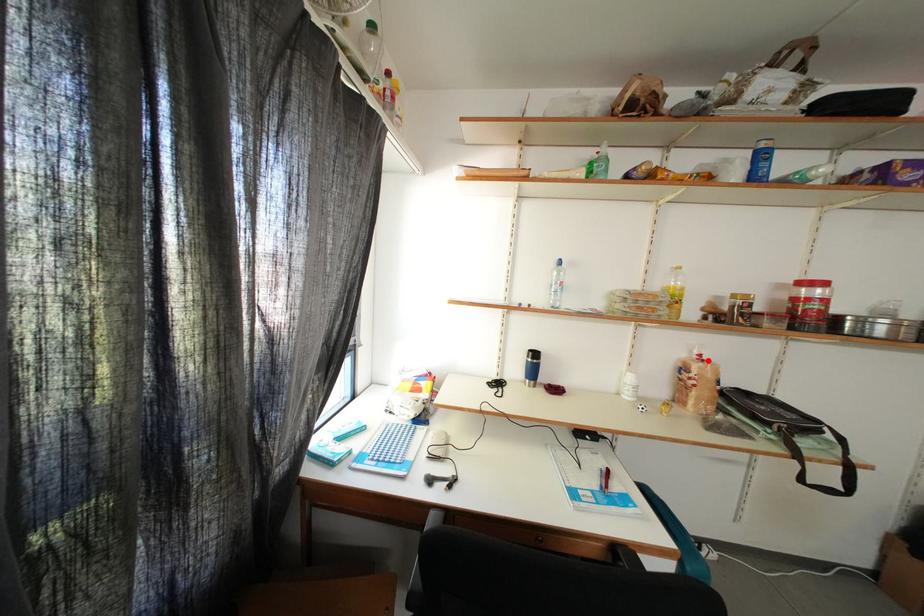
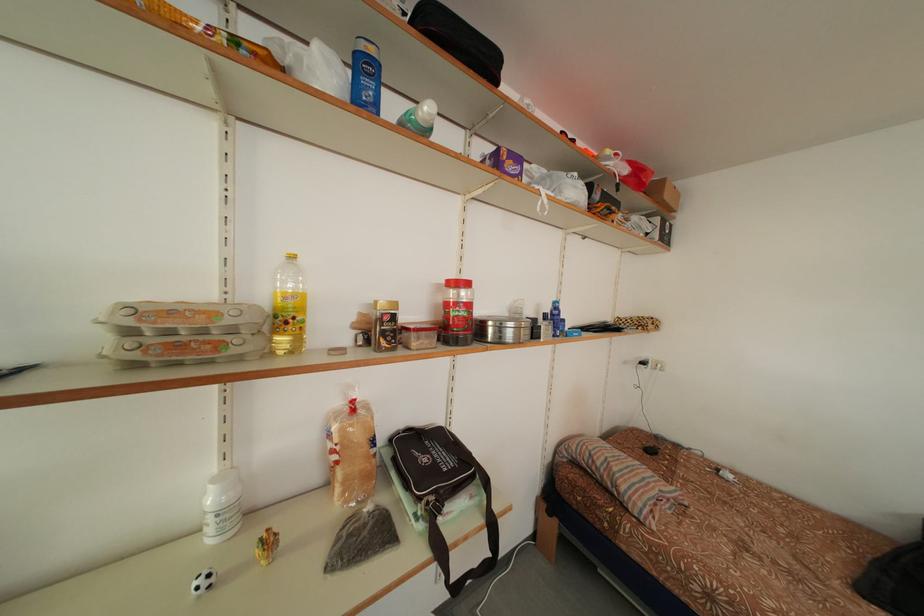
Find the pixel in the second image that matches the highlighted location in the first image.

(360, 407)